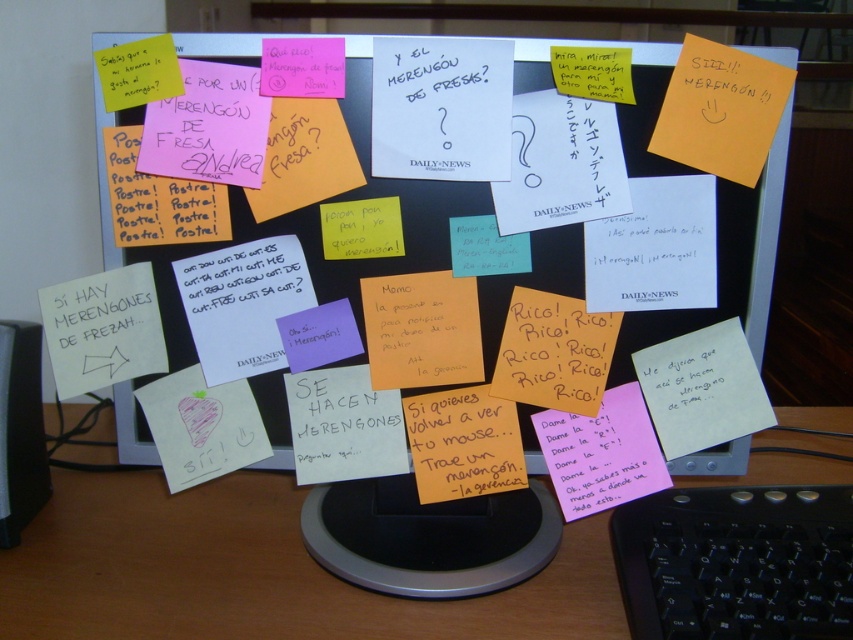
Question: Which object is farther from the camera taking this photo?

Choices:
 (A) white plastic table at center
 (B) black plastic keyboard at lower right
 (C) multicolored sticky notes at center

Answer: (C)

Question: Is multicolored sticky notes at center smaller than black plastic keyboard at lower right?

Choices:
 (A) yes
 (B) no

Answer: (B)

Question: Which point is farther to the camera?

Choices:
 (A) multicolored sticky notes at center
 (B) yellow paper at center
 (C) black plastic keyboard at lower right
 (D) white plastic table at center

Answer: (B)

Question: Is the position of multicolored sticky notes at center less distant than that of black plastic keyboard at lower right?

Choices:
 (A) yes
 (B) no

Answer: (B)

Question: Can you confirm if white plastic table at center is positioned below black plastic keyboard at lower right?

Choices:
 (A) no
 (B) yes

Answer: (A)

Question: Which point appears closest to the camera in this image?

Choices:
 (A) (325, 252)
 (B) (637, 67)

Answer: (B)